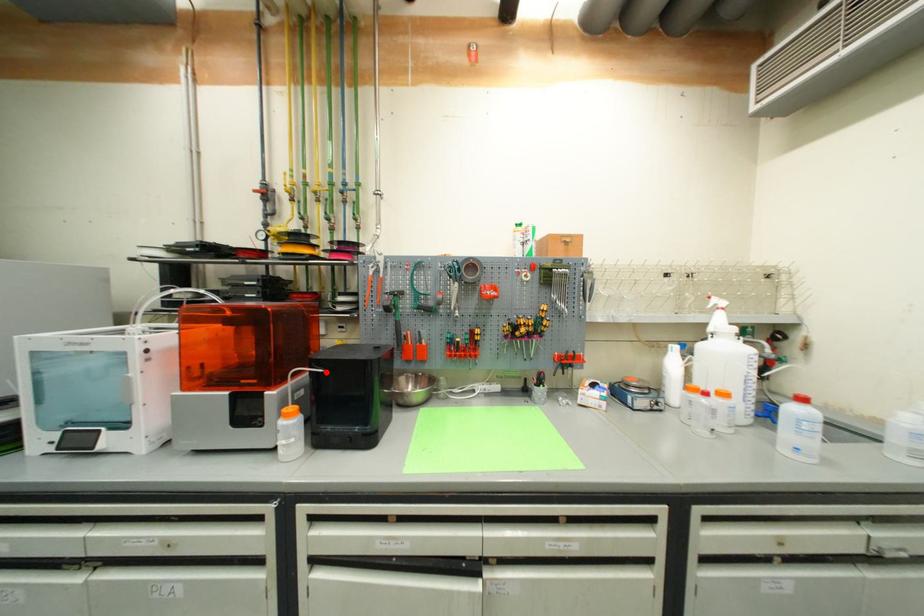
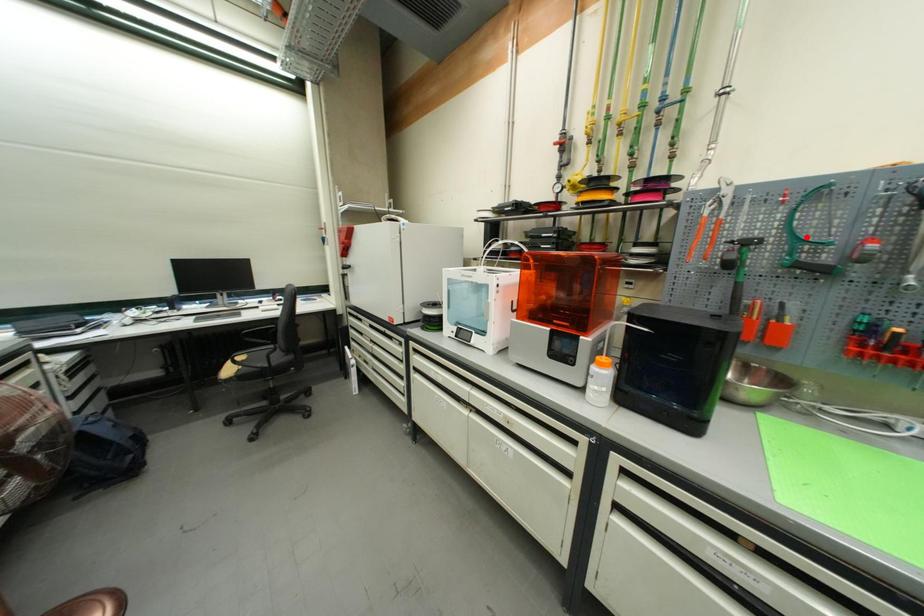
From the picture: I am providing you with two images of the same scene from different viewpoints. A red point is marked on the first image and another point is marked on the second image. Is the marked point in image1 the same physical position as the marked point in image2?

No